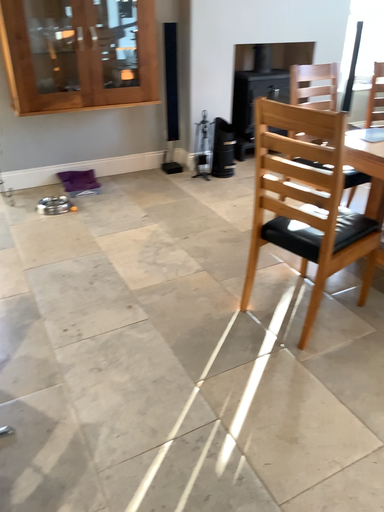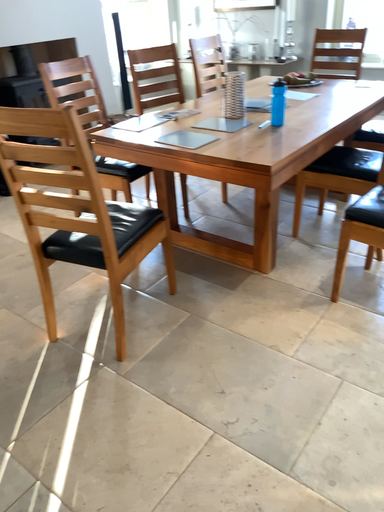
Question: Which way did the camera rotate in the video?

Choices:
 (A) rotated right
 (B) rotated left

Answer: (A)